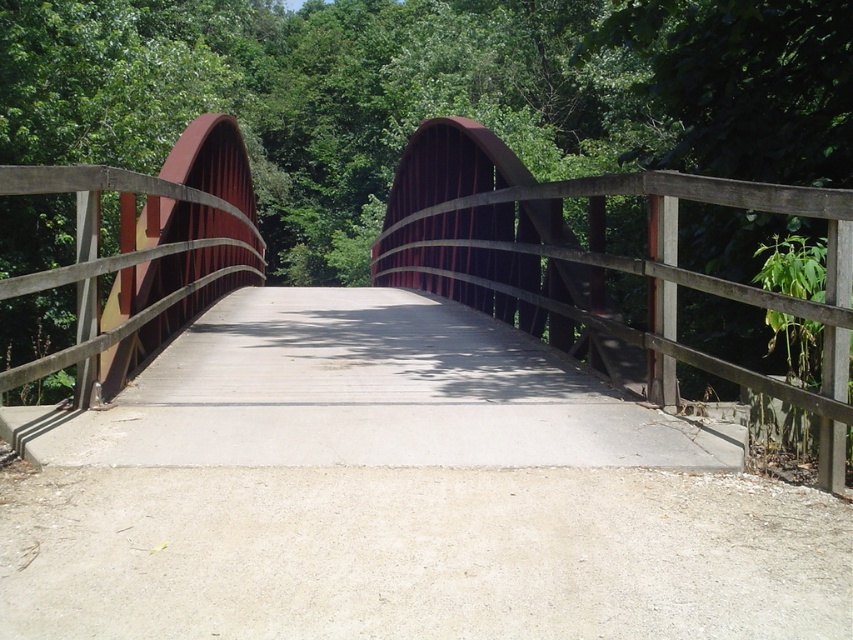
You are a maintenance worker needing to inspect the space between the metallic gray bridge at center and the concrete at center. Your inspection tool is 1.8 meters long. Will the tool fit into the space between them?

The distance between the metallic gray bridge at center and the concrete at center is 1.72 meters. Since the tool is 1.8 meters long, which is longer than the available space, the tool will not fit between them.

You are standing at the point marked by coordinates point (599, 262). What object are you standing on?

The point (599, 262) indicates that you are standing on the metallic gray bridge at center.